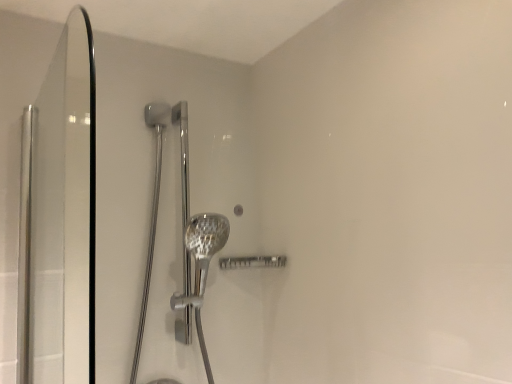
What do you see at coordinates (59, 218) in the screenshot? I see `transparent glass screen door at left` at bounding box center [59, 218].

Measure the distance between transparent glass screen door at left and camera.

transparent glass screen door at left and camera are 37.01 inches apart from each other.

This screenshot has width=512, height=384. I want to click on transparent glass screen door at left, so click(59, 218).

Locate an element on the screen. The height and width of the screenshot is (384, 512). transparent glass screen door at left is located at coordinates (59, 218).